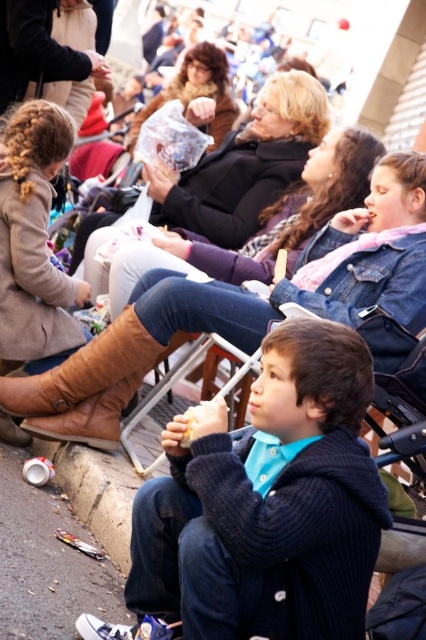
Question: Which object is positioned farthest from the denim jacket at center?

Choices:
 (A) leather boot at lower left
 (B) white paper sandwich at center

Answer: (B)

Question: Is denim jacket at center thinner than concrete pavement at lower left?

Choices:
 (A) no
 (B) yes

Answer: (A)

Question: Is leather boot at lower left to the left of white paper sandwich at center from the viewer's perspective?

Choices:
 (A) no
 (B) yes

Answer: (B)

Question: Can you confirm if knitted dark blue sweater at center is positioned to the right of denim jacket at center?

Choices:
 (A) yes
 (B) no

Answer: (B)

Question: Among these objects, which one is farthest from the camera?

Choices:
 (A) denim jacket at center
 (B) matte brown hair at center
 (C) white paper sandwich at center
 (D) concrete pavement at lower left

Answer: (B)

Question: Among these objects, which one is farthest from the camera?

Choices:
 (A) knitted dark blue sweater at center
 (B) concrete pavement at lower left
 (C) matte brown hair at center
 (D) denim jacket at upper center

Answer: (C)